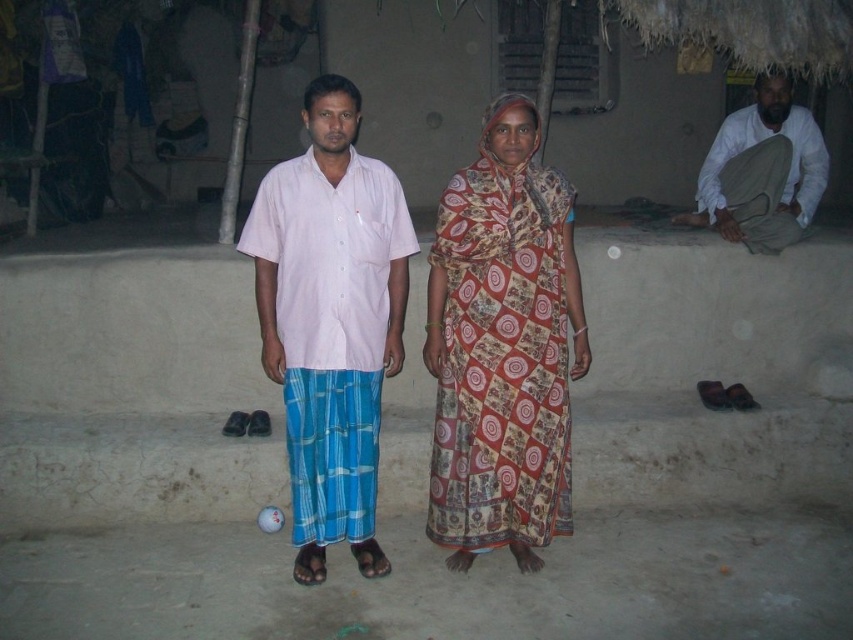
You are an observer in the scene and want to know which clothing item is narrower between the printed cotton sari at center and the light pink cotton shirt at center. Which one is it?

The printed cotton sari at center is thinner than the light pink cotton shirt at center, so the printed cotton sari at center is narrower.

You are a guest at this rustic indoor gathering and need to greet the person wearing the printed cotton sari at center and the white cotton shirt at right. Which one should you approach first if you enter from the left side of the image?

You should approach the printed cotton sari at center first because it is located to the left of the white cotton shirt at right, meaning it is closer to the entrance on the left side.